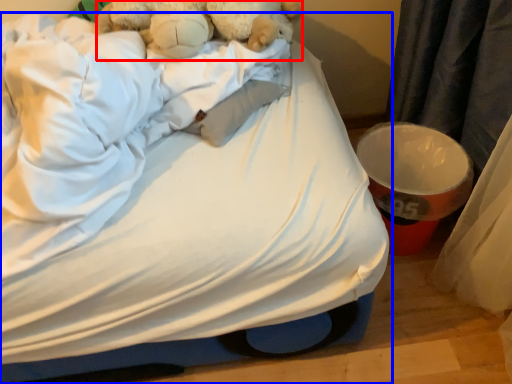
Question: Which point is closer to the camera, teddy bear (highlighted by a red box) or bed (highlighted by a blue box)?

Choices:
 (A) teddy bear
 (B) bed

Answer: (B)